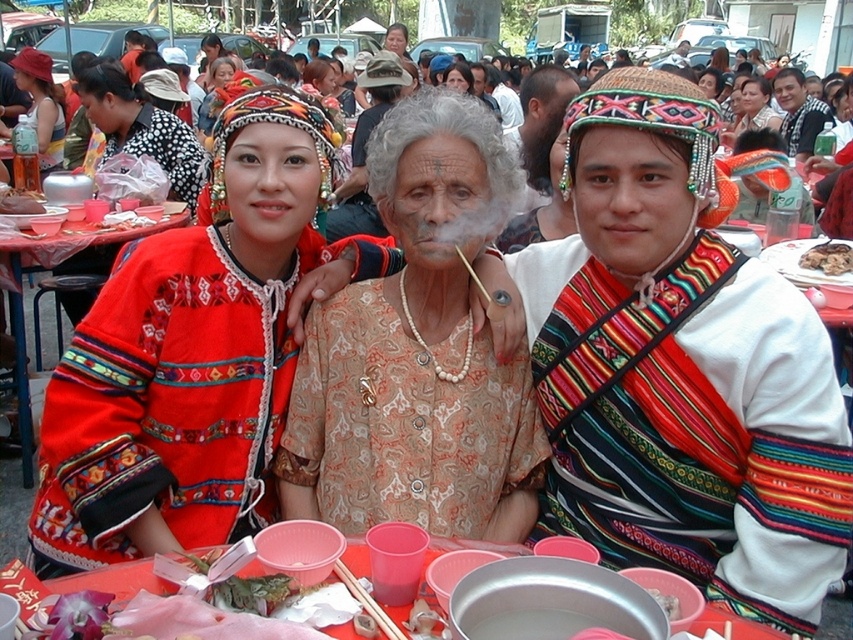
Between red fabric table at center and black woven shirt at upper center, which one is positioned lower?

red fabric table at center is below.

From the picture: Does red fabric table at center have a larger size compared to black woven shirt at upper center?

Actually, red fabric table at center might be smaller than black woven shirt at upper center.

Does point (112, 243) lie behind point (801, 113)?

No, it is in front of (801, 113).

Locate an element on the screen. Image resolution: width=853 pixels, height=640 pixels. red fabric table at center is located at coordinates (22, 298).

Who is more forward, (45, 92) or (811, 262)?

Positioned in front is point (811, 262).

The image size is (853, 640). What do you see at coordinates (41, 106) in the screenshot?
I see `matte black hat at upper left` at bounding box center [41, 106].

You are a GUI agent. You are given a task and a screenshot of the screen. Output one action in this format:
    pyautogui.click(x=<x>, y=<y>)
    Task: Click on the matte black hat at upper left
    The height and width of the screenshot is (640, 853).
    Given the screenshot: What is the action you would take?
    pyautogui.click(x=41, y=106)

Is black woven shirt at upper center closer to the viewer compared to pink plastic bowl at center?

No, black woven shirt at upper center is behind pink plastic bowl at center.

Does black woven shirt at upper center appear over pink plastic bowl at center?

Correct, black woven shirt at upper center is located above pink plastic bowl at center.

Between point (805, 140) and point (36, 204), which one is positioned in front?

Point (36, 204) is more forward.

At what (x,y) coordinates should I click in order to perform the action: click on black woven shirt at upper center. Please return your answer as a coordinate pair (x, y). Image resolution: width=853 pixels, height=640 pixels. Looking at the image, I should click on (804, 125).